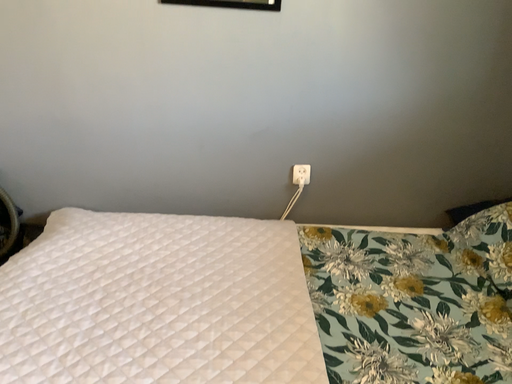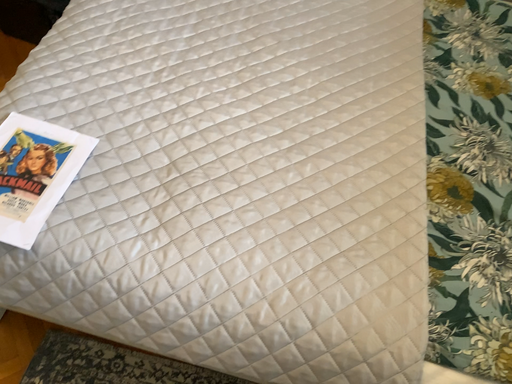
Question: Which way did the camera rotate in the video?

Choices:
 (A) rotated right
 (B) rotated left

Answer: (B)